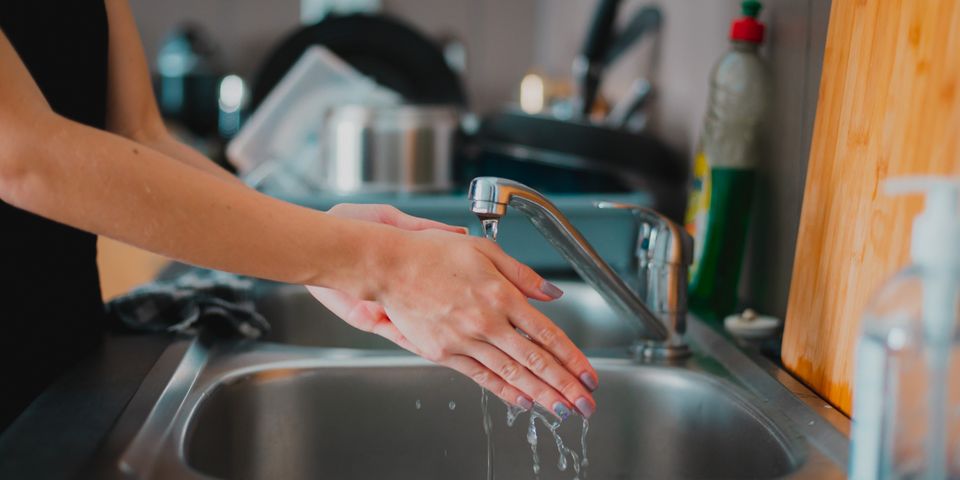
You are a GUI agent. You are given a task and a screenshot of the screen. Output one action in this format:
    pyautogui.click(x=<x>, y=<y>)
    Task: Click on the rag
    The image size is (960, 480).
    Given the screenshot: What is the action you would take?
    pyautogui.click(x=178, y=309)